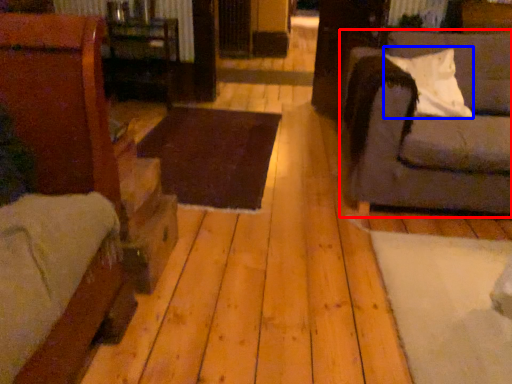
Question: Which object appears closest to the camera in this image, studio couch (highlighted by a red box) or pillow (highlighted by a blue box)?

Choices:
 (A) studio couch
 (B) pillow

Answer: (A)